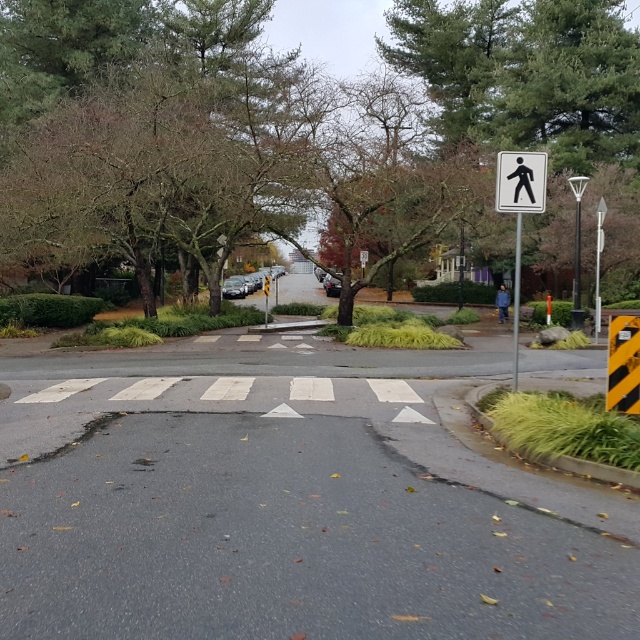
Question: Does black/yellow striped sign at right have a lesser width compared to white plastic pedestrian sign at upper right?

Choices:
 (A) yes
 (B) no

Answer: (A)

Question: Does black/yellow striped sign at right have a smaller size compared to white plastic pedestrian sign at upper right?

Choices:
 (A) yes
 (B) no

Answer: (A)

Question: Which point is closer to the camera?

Choices:
 (A) black/yellow striped sign at right
 (B) black plastic pedestrian sign at upper right
 (C) white plastic pedestrian sign at upper right

Answer: (A)

Question: Is black/yellow striped sign at right to the left of black plastic pedestrian sign at upper right from the viewer's perspective?

Choices:
 (A) no
 (B) yes

Answer: (A)

Question: Which of the following is the farthest from the observer?

Choices:
 (A) (579, 296)
 (B) (632, 396)
 (C) (534, 189)
 (D) (10, 88)

Answer: (D)

Question: Estimate the real-world distances between objects in this image. Which object is farther from the black plastic pedestrian sign at upper right?

Choices:
 (A) black/yellow striped sign at right
 (B) green leafy tree at upper center

Answer: (B)